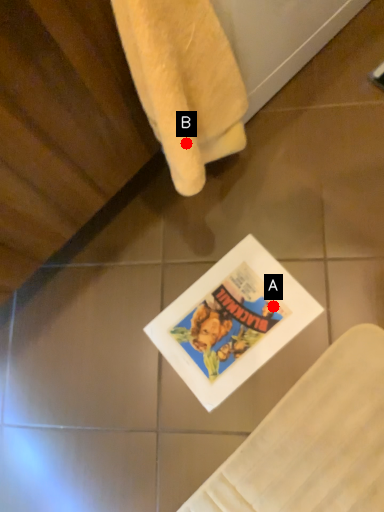
Question: Two points are circled on the image, labeled by A and B beside each circle. Which point is farther to the camera?

Choices:
 (A) A is further
 (B) B is further

Answer: (A)